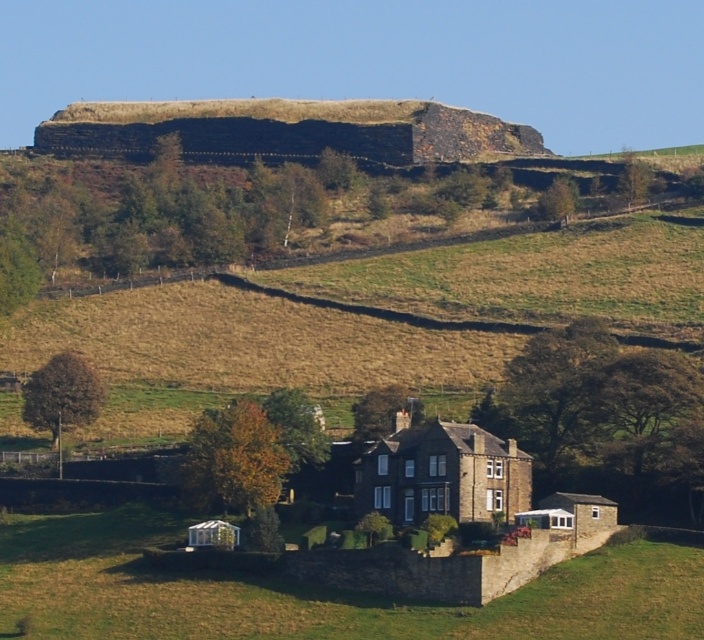
Does green grass at lower center have a smaller size compared to brown stone house at center?

No, green grass at lower center is not smaller than brown stone house at center.

Is green grass at lower center thinner than brown stone house at center?

No, green grass at lower center is not thinner than brown stone house at center.

The width and height of the screenshot is (704, 640). I want to click on green grass at lower center, so click(x=315, y=592).